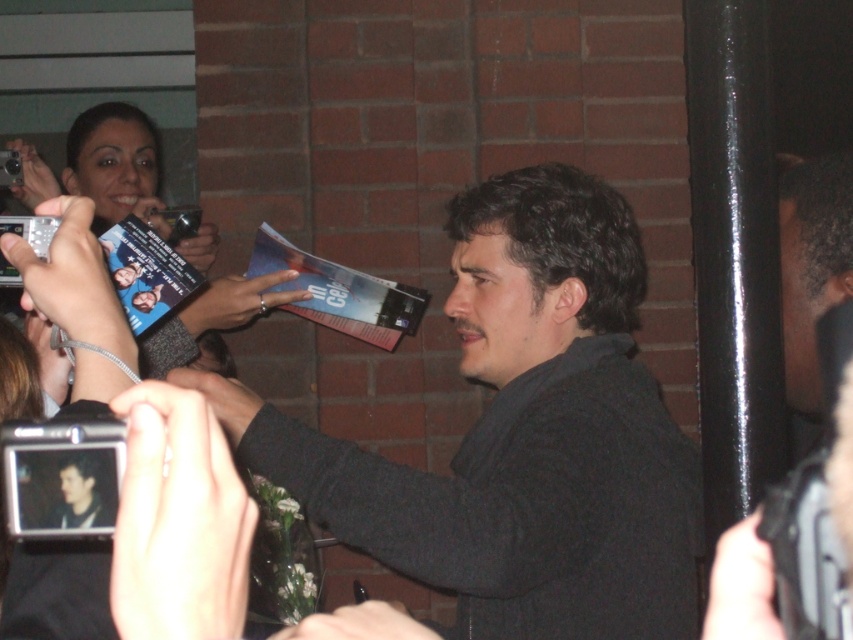
Question: Can you confirm if dark gray sweater at center is positioned to the left of matte black camera at upper left?

Choices:
 (A) yes
 (B) no

Answer: (B)

Question: Can you confirm if dark gray sweater at center is wider than matte black camera at upper left?

Choices:
 (A) no
 (B) yes

Answer: (A)

Question: From the image, what is the correct spatial relationship of dark gray sweater at center in relation to matte black camera at upper left?

Choices:
 (A) above
 (B) below

Answer: (B)

Question: Which of the following is the closest to the observer?

Choices:
 (A) matte black camera at upper left
 (B) dark gray sweater at center

Answer: (B)